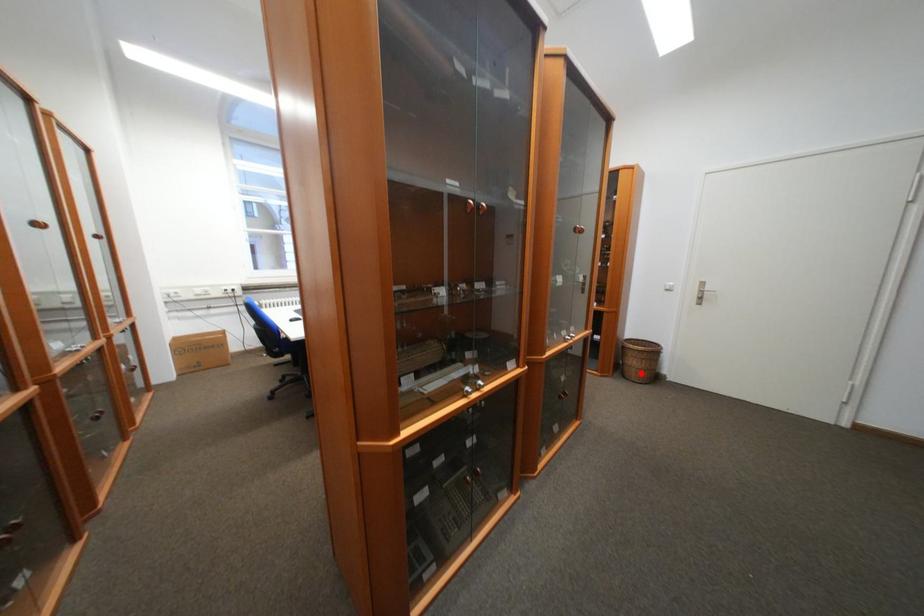
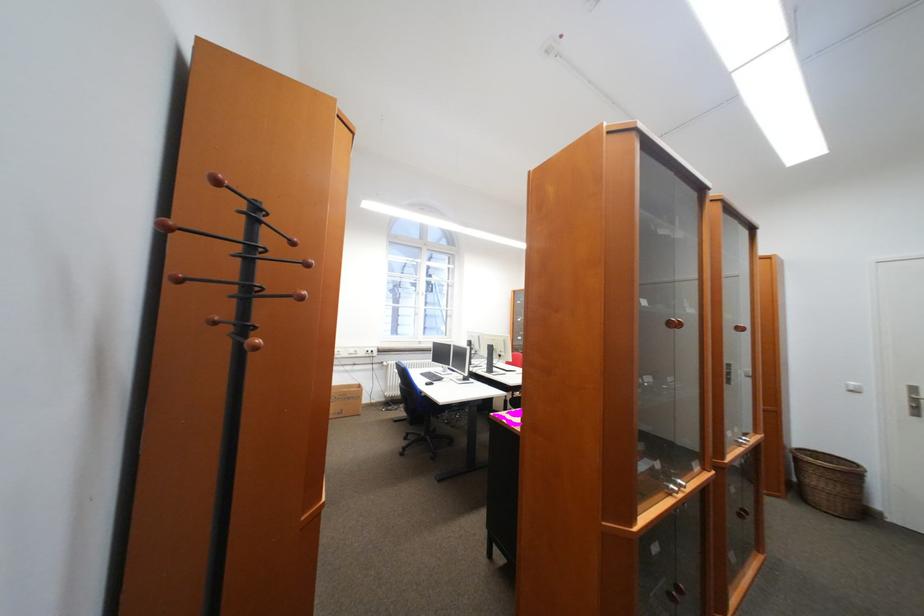
Find the pixel in the second image that matches the highlighted location in the first image.

(830, 499)